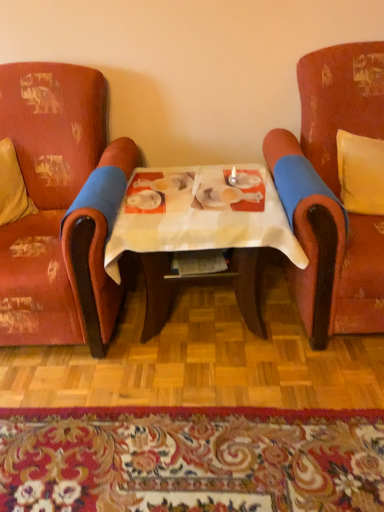
Question: Can you confirm if velvet-like red armchair at right, which is counted as the second chair, starting from the left, is bigger than distressed red fabric armchair at left, the second chair in the right-to-left sequence?

Choices:
 (A) yes
 (B) no

Answer: (B)

Question: From a real-world perspective, is velvet-like red armchair at right, the 1th chair from the right, physically below distressed red fabric armchair at left, positioned as the first chair in left-to-right order?

Choices:
 (A) no
 (B) yes

Answer: (A)

Question: Is velvet-like red armchair at right, which is counted as the second chair, starting from the left, with distressed red fabric armchair at left, the second chair in the right-to-left sequence?

Choices:
 (A) yes
 (B) no

Answer: (B)

Question: Would you say velvet-like red armchair at right, which is counted as the second chair, starting from the left, is a long distance from distressed red fabric armchair at left, positioned as the first chair in left-to-right order?

Choices:
 (A) no
 (B) yes

Answer: (A)

Question: Would you say velvet-like red armchair at right, which is counted as the second chair, starting from the left, is outside distressed red fabric armchair at left, the second chair in the right-to-left sequence?

Choices:
 (A) yes
 (B) no

Answer: (A)

Question: Is distressed red fabric armchair at left, positioned as the first chair in left-to-right order, at the back of velvet-like red armchair at right, the 1th chair from the right?

Choices:
 (A) yes
 (B) no

Answer: (B)

Question: From the image's perspective, would you say velvet-like red armchair at right, the 1th chair from the right, is shown under white paper table at center?

Choices:
 (A) no
 (B) yes

Answer: (A)

Question: From a real-world perspective, is velvet-like red armchair at right, which is counted as the second chair, starting from the left, over white paper table at center?

Choices:
 (A) yes
 (B) no

Answer: (A)

Question: Considering the relative sizes of velvet-like red armchair at right, the 1th chair from the right, and white paper table at center in the image provided, is velvet-like red armchair at right, the 1th chair from the right, taller than white paper table at center?

Choices:
 (A) yes
 (B) no

Answer: (A)

Question: Can you see velvet-like red armchair at right, the 1th chair from the right, touching white paper table at center?

Choices:
 (A) no
 (B) yes

Answer: (A)

Question: Is velvet-like red armchair at right, which is counted as the second chair, starting from the left, in front of white paper table at center?

Choices:
 (A) no
 (B) yes

Answer: (B)

Question: Is velvet-like red armchair at right, the 1th chair from the right, positioned beyond the bounds of white paper table at center?

Choices:
 (A) yes
 (B) no

Answer: (A)

Question: Is beige fabric pillow at left, placed as the 2th pillow when sorted from right to left, oriented away from floral carpet at lower center?

Choices:
 (A) yes
 (B) no

Answer: (B)